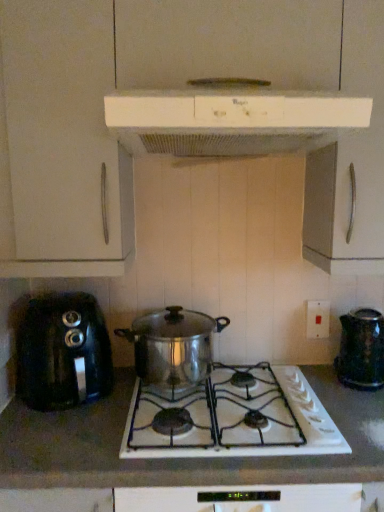
Question: Which direction should I rotate to face shiny metallic pot at center, marked as the second kitchen appliance in a top-to-bottom arrangement, — up or down?

Choices:
 (A) up
 (B) down

Answer: (B)

Question: From the image's perspective, is shiny metallic kettle at right, acting as the 1th kitchen appliance starting from the right, under black plastic toaster at left, which appears as the 3th kitchen appliance when viewed from the top?

Choices:
 (A) yes
 (B) no

Answer: (A)

Question: Is shiny metallic kettle at right, acting as the 1th kitchen appliance starting from the right, outside black plastic toaster at left, which appears as the 3th kitchen appliance when viewed from the top?

Choices:
 (A) yes
 (B) no

Answer: (A)

Question: Is shiny metallic kettle at right, acting as the 1th kitchen appliance starting from the right, oriented towards black plastic toaster at left, positioned as the 4th kitchen appliance in right-to-left order?

Choices:
 (A) no
 (B) yes

Answer: (A)

Question: Does shiny metallic kettle at right, marked as the fourth kitchen appliance in a left-to-right arrangement, have a smaller size compared to black plastic toaster at left, positioned as the 4th kitchen appliance in right-to-left order?

Choices:
 (A) yes
 (B) no

Answer: (A)

Question: Is shiny metallic kettle at right, acting as the 1th kitchen appliance starting from the right, surrounding black plastic toaster at left, which appears as the 3th kitchen appliance when viewed from the top?

Choices:
 (A) no
 (B) yes

Answer: (A)

Question: From the image's perspective, is shiny metallic kettle at right, marked as the fourth kitchen appliance in a left-to-right arrangement, located above black plastic toaster at left, which appears as the 3th kitchen appliance when viewed from the top?

Choices:
 (A) yes
 (B) no

Answer: (B)

Question: Considering the relative sizes of black plastic toaster at left, which appears as the 3th kitchen appliance when viewed from the top, and shiny metallic pot at center, arranged as the third kitchen appliance when ordered from the bottom, in the image provided, is black plastic toaster at left, which appears as the 3th kitchen appliance when viewed from the top, bigger than shiny metallic pot at center, arranged as the third kitchen appliance when ordered from the bottom,?

Choices:
 (A) no
 (B) yes

Answer: (B)

Question: From the image's perspective, is black plastic toaster at left, which appears as the 3th kitchen appliance when viewed from the top, beneath shiny metallic pot at center, marked as the second kitchen appliance in a top-to-bottom arrangement?

Choices:
 (A) no
 (B) yes

Answer: (B)

Question: Can you confirm if black plastic toaster at left, positioned as the first kitchen appliance in left-to-right order, is thinner than shiny metallic pot at center, the 2th kitchen appliance when ordered from left to right?

Choices:
 (A) yes
 (B) no

Answer: (B)

Question: Is black plastic toaster at left, which appears as the 3th kitchen appliance when viewed from the top, not near shiny metallic pot at center, arranged as the third kitchen appliance when ordered from the bottom?

Choices:
 (A) yes
 (B) no

Answer: (B)

Question: Is black plastic toaster at left, which appears as the 3th kitchen appliance when viewed from the top, further to the viewer compared to shiny metallic pot at center, which ranks as the 3th kitchen appliance in right-to-left order?

Choices:
 (A) no
 (B) yes

Answer: (A)

Question: Is black plastic toaster at left, positioned as the 4th kitchen appliance in right-to-left order, positioned before shiny metallic pot at center, marked as the second kitchen appliance in a top-to-bottom arrangement?

Choices:
 (A) yes
 (B) no

Answer: (A)

Question: Would you say white plastic electric outlet at right is part of shiny metallic kettle at right, marked as the fourth kitchen appliance in a left-to-right arrangement,'s contents?

Choices:
 (A) yes
 (B) no

Answer: (B)